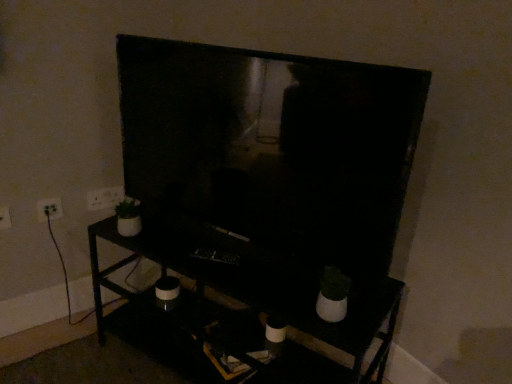
Question: From a real-world perspective, is white plastic electric outlet at upper left, the first electric outlet in the back-to-front sequence, located higher than white plastic electric outlet at left, which appears as the 2th electric outlet when viewed from the left?

Choices:
 (A) no
 (B) yes

Answer: (B)

Question: Are white plastic electric outlet at upper left, marked as the 3th electric outlet in a front-to-back arrangement, and white plastic electric outlet at left, positioned as the second electric outlet in front-to-back order, far apart?

Choices:
 (A) yes
 (B) no

Answer: (B)

Question: Does white plastic electric outlet at upper left, the 1th electric outlet viewed from the right, have a greater height compared to white plastic electric outlet at left, marked as the second electric outlet in a right-to-left arrangement?

Choices:
 (A) no
 (B) yes

Answer: (B)

Question: Could white plastic electric outlet at left, positioned as the second electric outlet in front-to-back order, be considered to be inside white plastic electric outlet at upper left, the 1th electric outlet viewed from the right?

Choices:
 (A) no
 (B) yes

Answer: (A)

Question: Does white plastic electric outlet at upper left, the first electric outlet in the back-to-front sequence, have a greater width compared to white plastic electric outlet at left, positioned as the second electric outlet in front-to-back order?

Choices:
 (A) yes
 (B) no

Answer: (B)

Question: Is white plastic electric outlet at upper left, the first electric outlet in the back-to-front sequence, looking in the opposite direction of white plastic electric outlet at left, marked as the second electric outlet in a right-to-left arrangement?

Choices:
 (A) no
 (B) yes

Answer: (A)

Question: From the image's perspective, is white plastic electric outlet at left, the 1th electric outlet positioned from the front, located above matte black tv at center?

Choices:
 (A) yes
 (B) no

Answer: (B)

Question: Is white plastic electric outlet at left, acting as the 3th electric outlet starting from the back, not inside matte black tv at center?

Choices:
 (A) yes
 (B) no

Answer: (A)

Question: Can you confirm if white plastic electric outlet at left, acting as the 3th electric outlet starting from the back, is shorter than matte black tv at center?

Choices:
 (A) no
 (B) yes

Answer: (B)

Question: Could you tell me if white plastic electric outlet at left, acting as the first electric outlet starting from the left, is turned towards matte black tv at center?

Choices:
 (A) no
 (B) yes

Answer: (A)

Question: Is white plastic electric outlet at left, acting as the first electric outlet starting from the left, not near matte black tv at center?

Choices:
 (A) yes
 (B) no

Answer: (B)

Question: Are white plastic electric outlet at left, acting as the 3th electric outlet starting from the back, and matte black tv at center making contact?

Choices:
 (A) no
 (B) yes

Answer: (A)

Question: From the image's perspective, does white plastic electric outlet at left, acting as the 3th electric outlet starting from the back, appear lower than white plastic electric outlet at upper left, marked as the 3th electric outlet in a front-to-back arrangement?

Choices:
 (A) yes
 (B) no

Answer: (A)